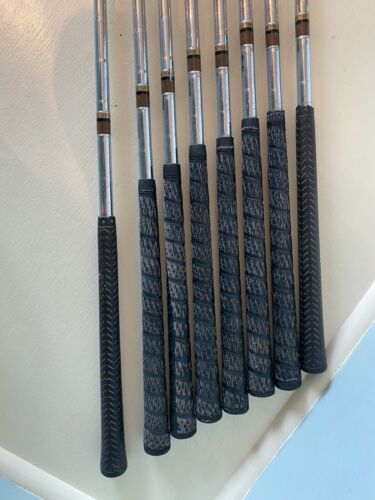
The width and height of the screenshot is (375, 500). I want to click on floor, so click(321, 464).